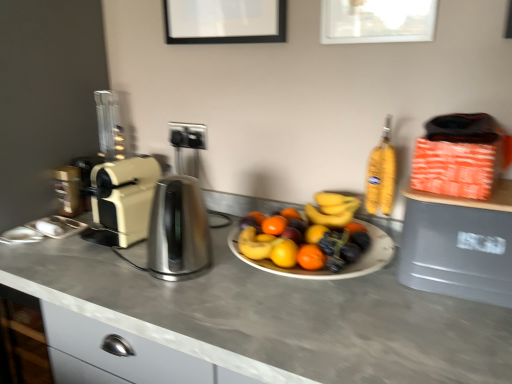
Locate an element on the screen. vacant space in front of metallic silver coffee machine at left is located at coordinates (55, 237).